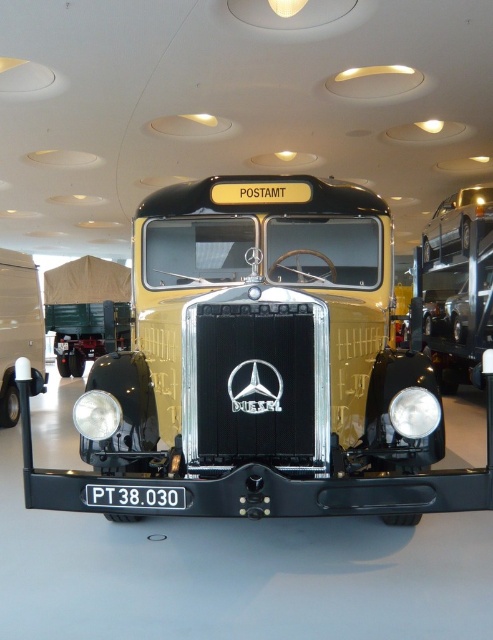
Which is behind, point (129, 497) or point (102, 403)?

Positioned behind is point (102, 403).

Does black plastic license plate at center appear under matte silver headlight at center?

Correct, black plastic license plate at center is located below matte silver headlight at center.

Which is behind, point (151, 506) or point (98, 426)?

Point (98, 426)

Locate an element on the screen. black plastic license plate at center is located at coordinates (137, 497).

Is shiny silver car at upper right to the right of matte silver headlight at lower right from the viewer's perspective?

Correct, you'll find shiny silver car at upper right to the right of matte silver headlight at lower right.

Which of these two, shiny silver car at upper right or matte silver headlight at lower right, stands shorter?

With less height is matte silver headlight at lower right.

Does point (444, 216) come farther from viewer compared to point (406, 417)?

Yes, point (444, 216) is behind point (406, 417).

You are a GUI agent. You are given a task and a screenshot of the screen. Output one action in this format:
    pyautogui.click(x=<x>, y=<y>)
    Task: Click on the shiny silver car at upper right
    Image resolution: width=493 pixels, height=640 pixels.
    Given the screenshot: What is the action you would take?
    pyautogui.click(x=456, y=221)

Which is behind, point (400, 433) or point (96, 438)?

The point (96, 438) is behind.

Is point (406, 435) more distant than point (100, 406)?

No, it is not.

The height and width of the screenshot is (640, 493). I want to click on matte silver headlight at lower right, so click(415, 412).

Find the location of a particular element. matte silver headlight at lower right is located at coordinates tap(415, 412).